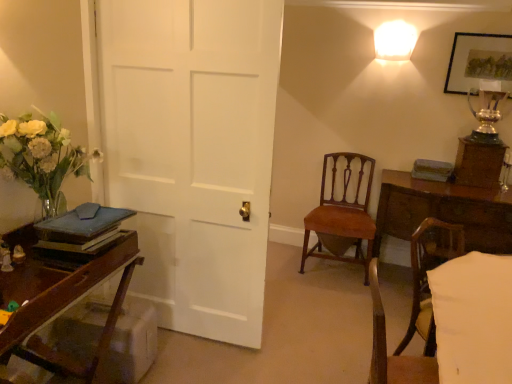
Question: Is silver metallic trophy at upper right not inside light brown wood chair at lower right, which ranks as the 1th chair in front-to-back order?

Choices:
 (A) yes
 (B) no

Answer: (A)

Question: Is silver metallic trophy at upper right directly adjacent to light brown wood chair at lower right, which ranks as the 1th chair in front-to-back order?

Choices:
 (A) yes
 (B) no

Answer: (B)

Question: From a real-world perspective, is silver metallic trophy at upper right under light brown wood chair at lower right, which is the second chair in back-to-front order?

Choices:
 (A) no
 (B) yes

Answer: (A)

Question: Does silver metallic trophy at upper right have a larger size compared to light brown wood chair at lower right, which is the second chair in back-to-front order?

Choices:
 (A) no
 (B) yes

Answer: (A)

Question: Does silver metallic trophy at upper right come behind light brown wood chair at lower right, which is the second chair in back-to-front order?

Choices:
 (A) no
 (B) yes

Answer: (B)

Question: Does point (416, 258) appear closer or farther from the camera than point (332, 236)?

Choices:
 (A) farther
 (B) closer

Answer: (B)

Question: Is light brown wood chair at lower right, which ranks as the 1th chair in front-to-back order, in front of or behind mahogany wood chair at center, the 1th chair viewed from the back, in the image?

Choices:
 (A) behind
 (B) front

Answer: (B)

Question: Looking at their shapes, would you say light brown wood chair at lower right, which is the second chair in back-to-front order, is wider or thinner than mahogany wood chair at center, the 1th chair viewed from the back?

Choices:
 (A) wide
 (B) thin

Answer: (B)

Question: Is light brown wood chair at lower right, which is the second chair in back-to-front order, to the left or to the right of mahogany wood chair at center, the 1th chair viewed from the back, in the image?

Choices:
 (A) right
 (B) left

Answer: (A)

Question: Is wooden desk at left bigger or smaller than wooden picture frame at upper right?

Choices:
 (A) small
 (B) big

Answer: (B)

Question: From a real-world perspective, is wooden desk at left above or below wooden picture frame at upper right?

Choices:
 (A) below
 (B) above

Answer: (A)

Question: Looking at their shapes, would you say wooden desk at left is wider or thinner than wooden picture frame at upper right?

Choices:
 (A) wide
 (B) thin

Answer: (A)

Question: In the image, is wooden desk at left positioned in front of or behind wooden picture frame at upper right?

Choices:
 (A) front
 (B) behind

Answer: (A)

Question: From the image's perspective, relative to wooden picture frame at upper right, is mahogany wood chair at center, the 1th chair viewed from the back, above or below?

Choices:
 (A) below
 (B) above

Answer: (A)

Question: Visually, is mahogany wood chair at center, the 1th chair viewed from the back, positioned to the left or to the right of wooden picture frame at upper right?

Choices:
 (A) right
 (B) left

Answer: (B)